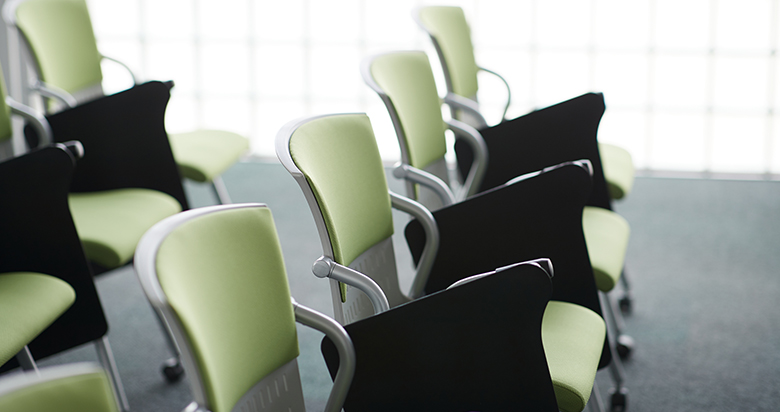
The width and height of the screenshot is (780, 412). Identify the location of black arm rest. (504, 307), (551, 204), (569, 143), (125, 135), (13, 212).